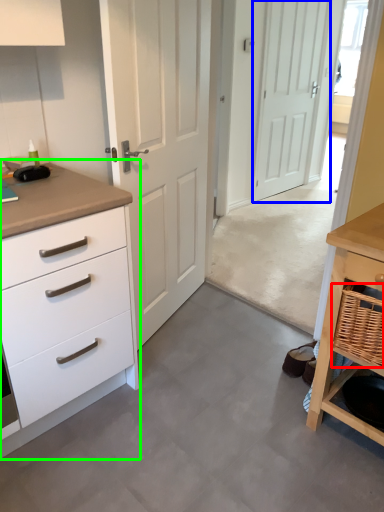
Question: Which object is positioned farthest from basket (highlighted by a red box)? Select from door (highlighted by a blue box) and chest of drawers (highlighted by a green box).

Choices:
 (A) door
 (B) chest of drawers

Answer: (A)